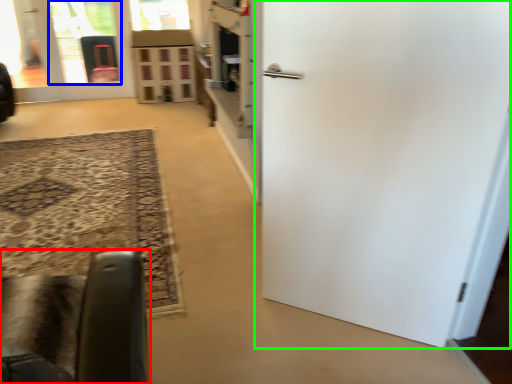
Question: Based on their relative distances, which object is nearer to furniture (highlighted by a red box)? Choose from glass door (highlighted by a blue box) and door (highlighted by a green box).

Choices:
 (A) glass door
 (B) door

Answer: (B)